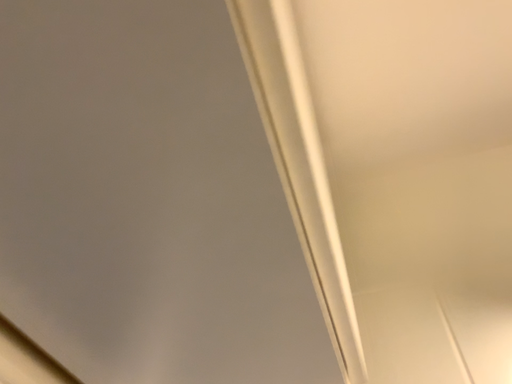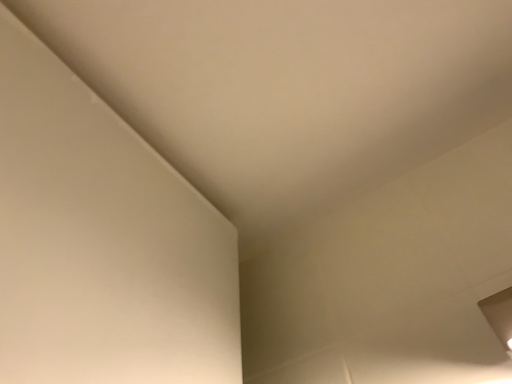
Question: How did the camera likely rotate when shooting the video?

Choices:
 (A) rotated right
 (B) rotated left

Answer: (B)